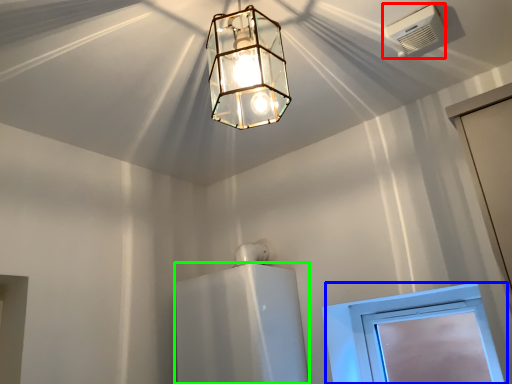
Question: Which is farther away from air conditioning (highlighted by a red box)? window (highlighted by a blue box) or appliance (highlighted by a green box)?

Choices:
 (A) window
 (B) appliance

Answer: (B)